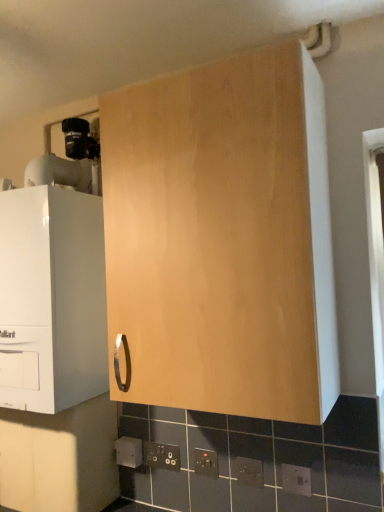
Question: Is point (291, 487) closer or farther from the camera than point (56, 437)?

Choices:
 (A) farther
 (B) closer

Answer: (B)

Question: Is matte black electric outlet at lower center, positioned as the first electric outlet in right-to-left order, situated inside matte wood cabinet at lower left, positioned as the second cabinetry in right-to-left order, or outside?

Choices:
 (A) inside
 (B) outside

Answer: (B)

Question: Which object is positioned farthest from the black plastic/socket at lower center, placed as the 2th electric outlet when sorted from front to back?

Choices:
 (A) white plastic electric outlet at lower center, the 5th electric outlet positioned from the right
 (B) matte black socket at lower center, the second electric outlet positioned from the left
 (C) black plastic electric outlet at lower center, positioned as the third electric outlet in back-to-front order
 (D) light wood cabinet at center, acting as the 3th cabinetry starting from the left
 (E) matte wood cabinet at lower left, which is counted as the 2th cabinetry, starting from the left

Answer: (D)

Question: Which of these objects is positioned farthest from the matte black socket at lower center, acting as the second electric outlet starting from the back?

Choices:
 (A) light wood cabinet at center, acting as the 3th cabinetry starting from the left
 (B) matte black electric outlet at lower center, arranged as the fifth electric outlet when viewed from the left
 (C) matte white boiler at left, arranged as the 1th cabinetry when viewed from the left
 (D) matte wood cabinet at lower left, which is counted as the 2th cabinetry, starting from the left
 (E) white plastic electric outlet at lower center, the 5th electric outlet positioned from the right

Answer: (A)